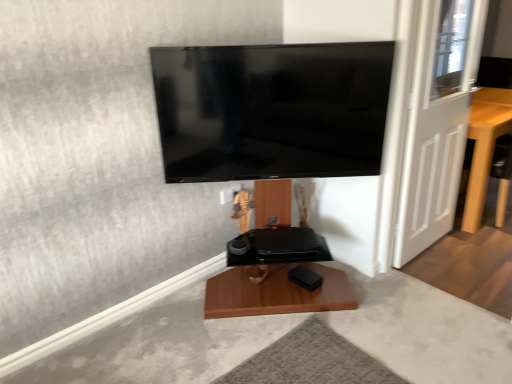
Question: Considering the positions of light brown wooden table at right and flat screen tv at upper center in the image, is light brown wooden table at right wider or thinner than flat screen tv at upper center?

Choices:
 (A) wide
 (B) thin

Answer: (A)

Question: From their relative heights in the image, would you say light brown wooden table at right is taller or shorter than flat screen tv at upper center?

Choices:
 (A) short
 (B) tall

Answer: (B)

Question: Which object is the closest to the white wooden door at right?

Choices:
 (A) light brown wooden table at right
 (B) flat screen tv at upper center

Answer: (A)

Question: Estimate the real-world distances between objects in this image. Which object is farther from the flat screen tv at upper center?

Choices:
 (A) light brown wooden table at right
 (B) white wooden door at right

Answer: (A)